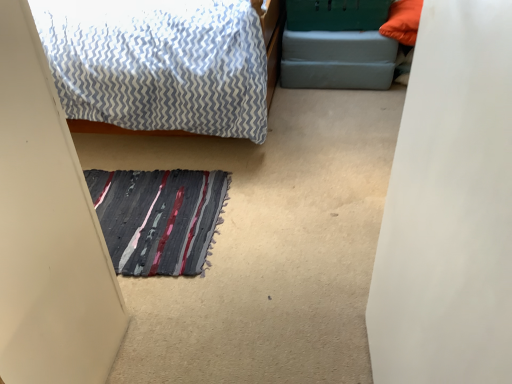
Question: Is textured wool doormat at center next to green plastic bed frame at upper center and touching it?

Choices:
 (A) no
 (B) yes

Answer: (A)

Question: Can you confirm if textured wool doormat at center is shorter than green plastic bed frame at upper center?

Choices:
 (A) no
 (B) yes

Answer: (B)

Question: From a real-world perspective, is textured wool doormat at center located higher than green plastic bed frame at upper center?

Choices:
 (A) no
 (B) yes

Answer: (A)

Question: Is textured wool doormat at center completely or partially outside of green plastic bed frame at upper center?

Choices:
 (A) yes
 (B) no

Answer: (A)

Question: From the image's perspective, would you say textured wool doormat at center is shown under green plastic bed frame at upper center?

Choices:
 (A) no
 (B) yes

Answer: (B)

Question: Is there a large distance between textured wool doormat at center and green plastic bed frame at upper center?

Choices:
 (A) no
 (B) yes

Answer: (B)

Question: Does green plastic bed frame at upper center have a lesser width compared to textured wool doormat at center?

Choices:
 (A) yes
 (B) no

Answer: (A)

Question: From a real-world perspective, is green plastic bed frame at upper center beneath textured wool doormat at center?

Choices:
 (A) no
 (B) yes

Answer: (A)

Question: Is green plastic bed frame at upper center smaller than textured wool doormat at center?

Choices:
 (A) no
 (B) yes

Answer: (A)

Question: Is green plastic bed frame at upper center facing away from textured wool doormat at center?

Choices:
 (A) no
 (B) yes

Answer: (A)

Question: Can textured wool doormat at center be found inside green plastic bed frame at upper center?

Choices:
 (A) yes
 (B) no

Answer: (B)

Question: Is green plastic bed frame at upper center outside textured wool doormat at center?

Choices:
 (A) no
 (B) yes

Answer: (B)

Question: Relative to textured wool doormat at center, is green plastic bed frame at upper center in front or behind?

Choices:
 (A) front
 (B) behind

Answer: (B)